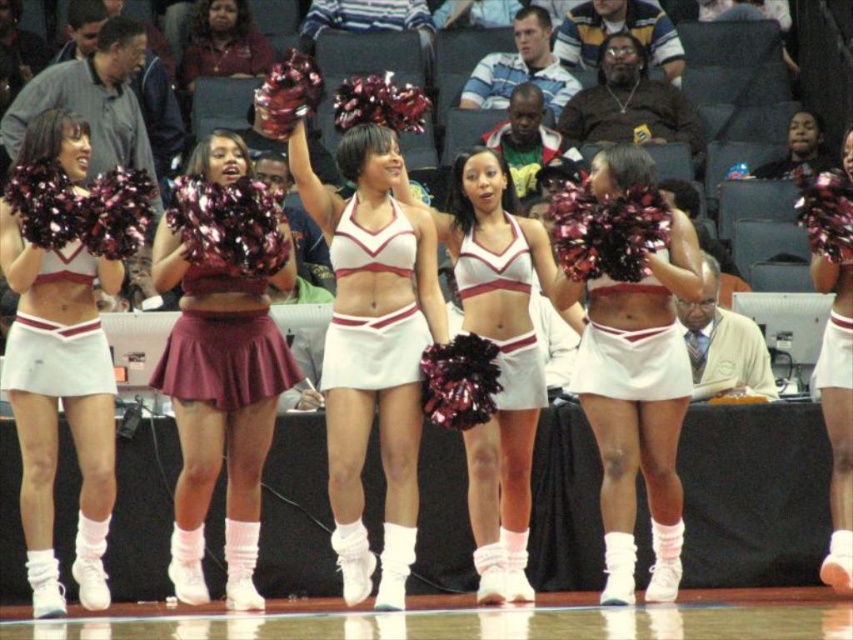
Question: Does white matte cheerleading outfit at center have a lesser width compared to white matte cheerleading uniform at center?

Choices:
 (A) no
 (B) yes

Answer: (A)

Question: Among these objects, which one is nearest to the camera?

Choices:
 (A) white matte cheerleading uniform at center
 (B) white matte cheerleading outfit at center

Answer: (B)

Question: Is white matte cheerleading outfit at center above white matte cheerleading uniform at center?

Choices:
 (A) no
 (B) yes

Answer: (A)

Question: Which of the following is the closest to the observer?

Choices:
 (A) 500,388
 (B) 357,196

Answer: (A)

Question: Is white matte cheerleading outfit at center to the right of white matte cheerleading uniform at center from the viewer's perspective?

Choices:
 (A) yes
 (B) no

Answer: (B)

Question: Which object appears farthest from the camera in this image?

Choices:
 (A) white matte cheerleading outfit at center
 (B) white matte cheerleading uniform at center

Answer: (B)